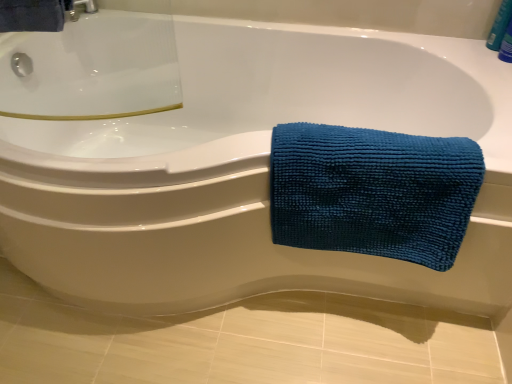
Where is `free location to the left of blue plastic bottle at upper right`? Image resolution: width=512 pixels, height=384 pixels. free location to the left of blue plastic bottle at upper right is located at coordinates (456, 40).